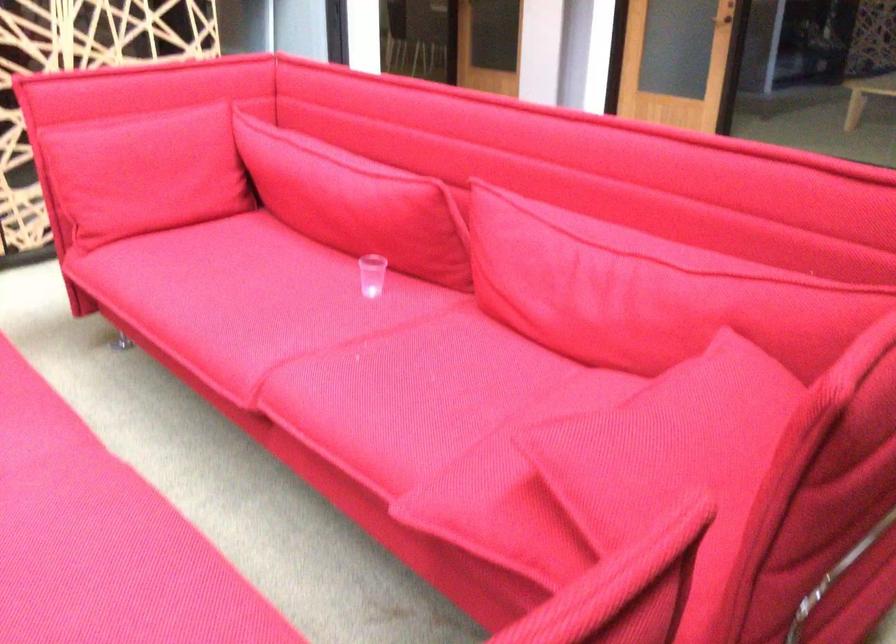
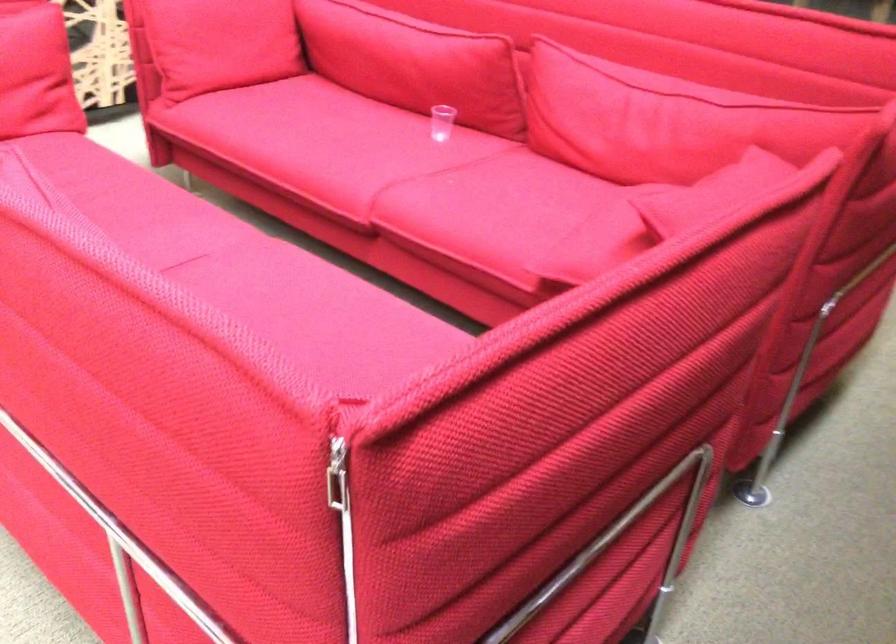
Locate, in the second image, the point that corresponds to point (382, 274) in the first image.

(442, 122)